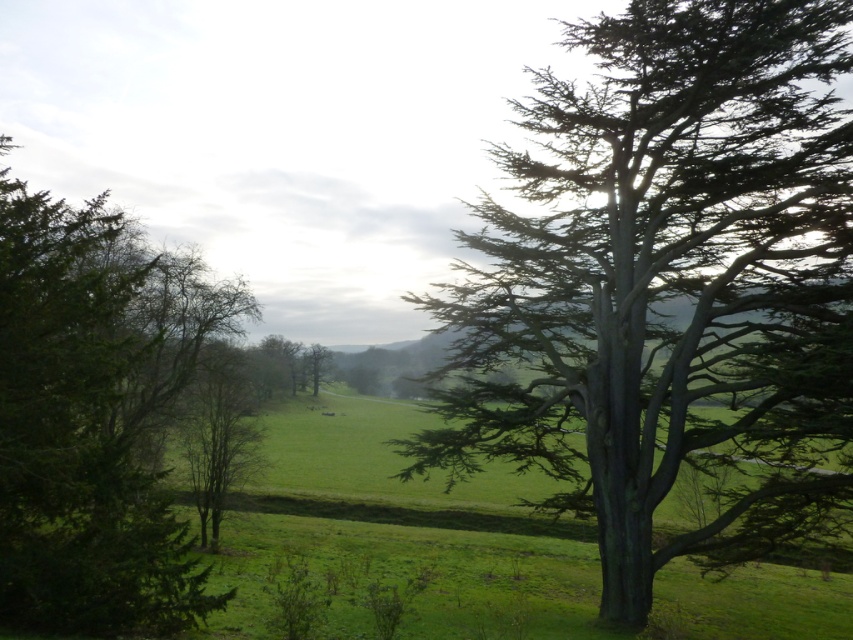
Measure the distance from green textured tree at right to bare branches at center.

45.26 feet

Is green textured tree at right positioned before bare branches at center?

That is True.

Does point (746, 550) come closer to viewer compared to point (219, 420)?

Yes, point (746, 550) is in front of point (219, 420).

Locate an element on the screen. The height and width of the screenshot is (640, 853). green textured tree at right is located at coordinates (668, 289).

Does green textured tree at right appear on the left side of green matte tree at center?

No, green textured tree at right is not to the left of green matte tree at center.

The height and width of the screenshot is (640, 853). What are the coordinates of `green textured tree at right` in the screenshot? It's located at (668, 289).

What are the coordinates of `bare branches at center` in the screenshot? It's located at (218, 433).

Does bare branches at center come behind green matte tree at center?

No.

This screenshot has width=853, height=640. In order to click on bare branches at center in this screenshot , I will do `click(218, 433)`.